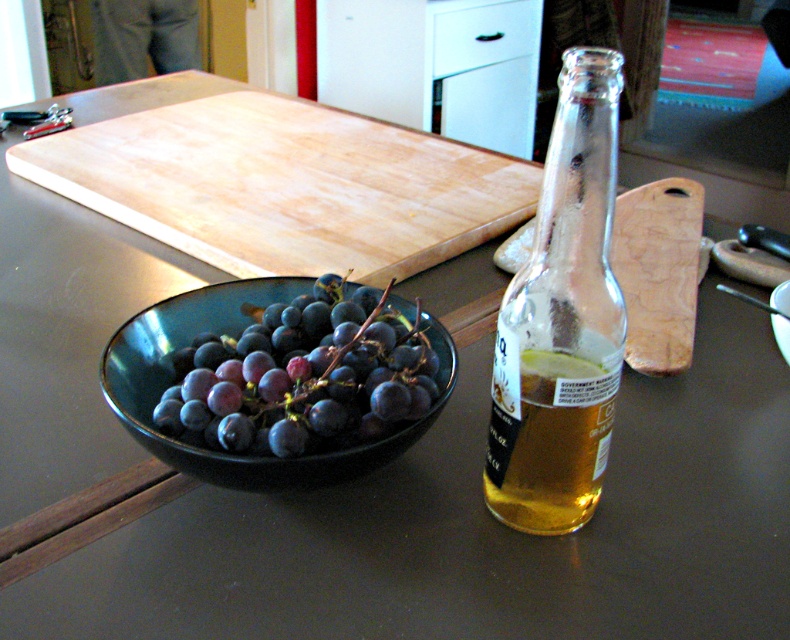
Between glossy ceramic bowl at lower left and wooden cutting board at right, which one has more height?

wooden cutting board at right

Is glossy ceramic bowl at lower left wider than wooden cutting board at right?

No.

Which is in front, point (262, 477) or point (659, 196)?

Point (262, 477)

Locate an element on the screen. This screenshot has height=640, width=790. glossy ceramic bowl at lower left is located at coordinates click(231, 333).

This screenshot has width=790, height=640. Describe the element at coordinates (231, 333) in the screenshot. I see `glossy ceramic bowl at lower left` at that location.

Is glossy ceramic bowl at lower left to the right of translucent glass beer at right from the viewer's perspective?

Incorrect, glossy ceramic bowl at lower left is not on the right side of translucent glass beer at right.

Does point (117, 352) come behind point (599, 493)?

That is True.

At what (x,y) coordinates should I click in order to perform the action: click on glossy ceramic bowl at lower left. Please return your answer as a coordinate pair (x, y). The image size is (790, 640). Looking at the image, I should click on (231, 333).

Between point (517, 509) and point (655, 342), which one is positioned behind?

The point (655, 342) is more distant.

Which is behind, point (555, 141) or point (687, 262)?

Point (687, 262)

This screenshot has height=640, width=790. I want to click on clear glass bottle at center, so click(x=561, y=321).